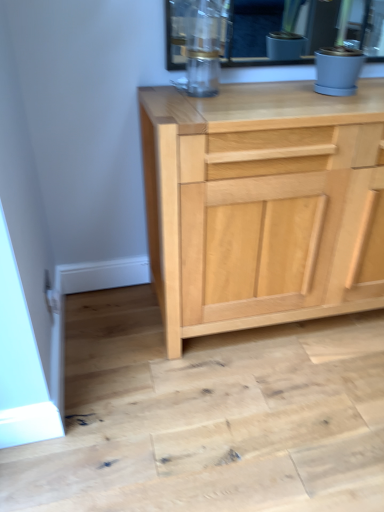
The image size is (384, 512). Identify the location of free space in front of natural wood cabinet at center. (275, 406).